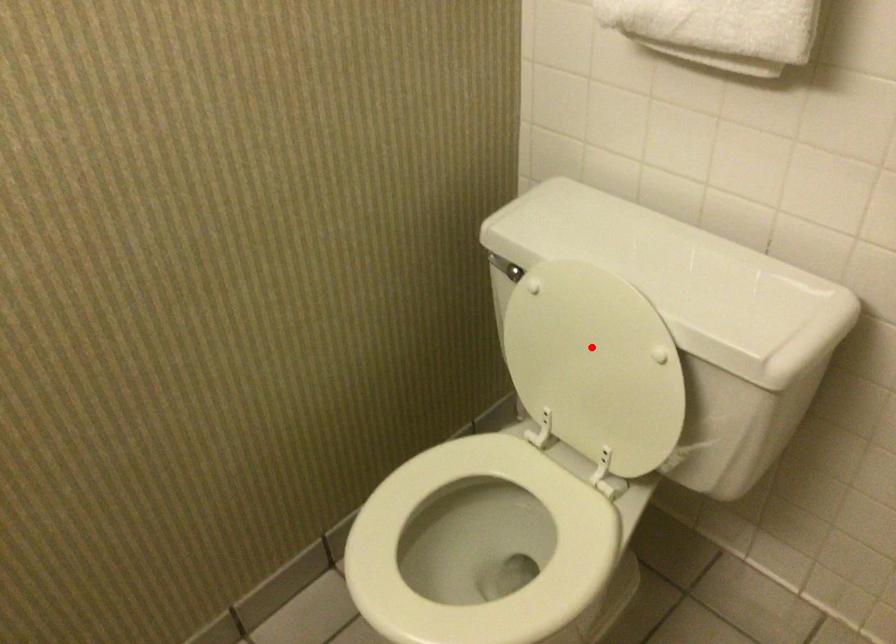
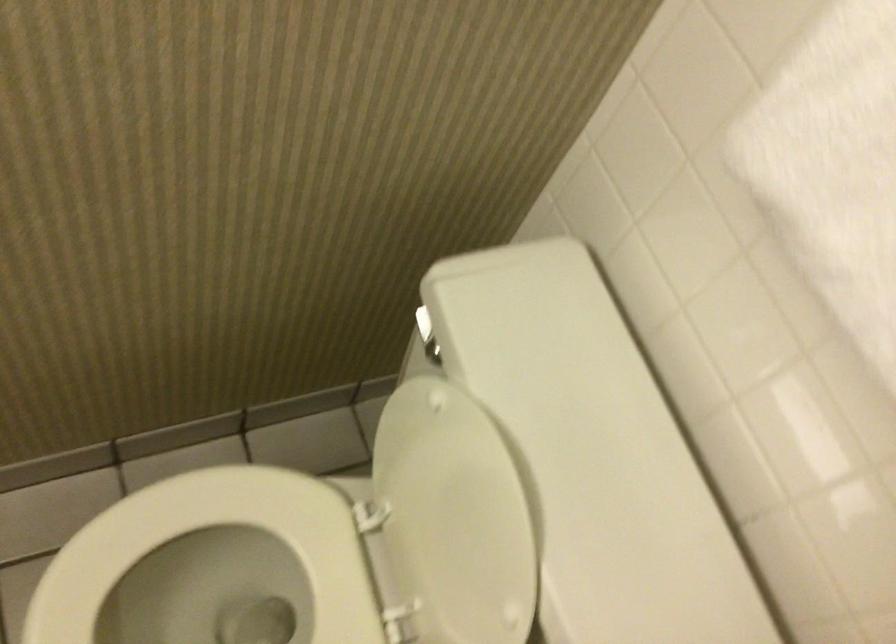
Question: I am providing you with two images of the same scene from different viewpoints. A red point is shown in image1. For the corresponding object point in image2, is it positioned nearer or farther from the camera?

Choices:
 (A) Nearer
 (B) Farther

Answer: (A)